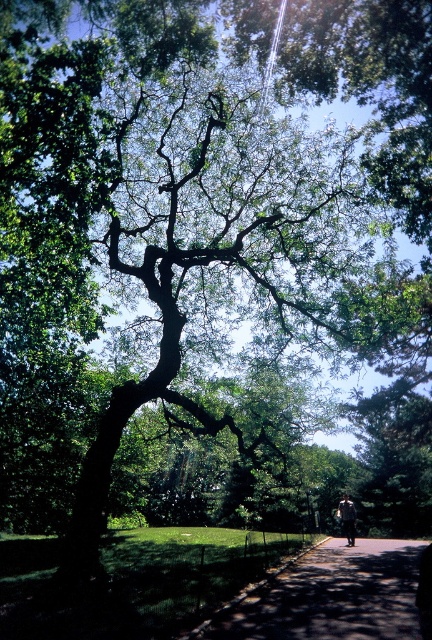
You are a gardener standing on the paved asphalt path at center. You want to walk towards the camouflage fabric man at center. Can you pass by them without leaving the path?

The paved asphalt path at center is wider than the camouflage fabric man at center, so yes, you can pass by them while staying on the path.

You are standing at the point with coordinates point (353, 637) and want to walk towards the point with coordinates point (350, 504). Since both points are on the same path, will you be moving forward or backward relative to the camera?

Since point (353, 637) is closer to the camera than point (350, 504), moving from point (353, 637) to point (350, 504) means you are moving forward away from the camera.